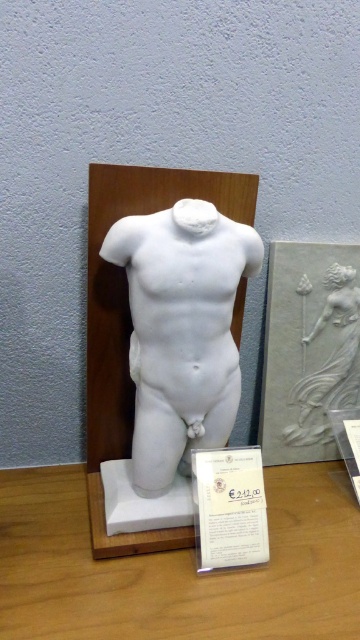
Question: Estimate the real-world distances between objects in this image. Which object is closer to the white marble torso at center?

Choices:
 (A) white marble relief at center
 (B) white paper at center
 (C) wooden table at center

Answer: (B)

Question: Estimate the real-world distances between objects in this image. Which object is farther from the white marble relief at center?

Choices:
 (A) white marble torso at center
 (B) wooden table at center
 (C) white paper at center

Answer: (A)

Question: Does white paper at center have a smaller size compared to white marble relief at center?

Choices:
 (A) no
 (B) yes

Answer: (B)

Question: Can you confirm if wooden table at center is smaller than white marble torso at center?

Choices:
 (A) yes
 (B) no

Answer: (B)

Question: Estimate the real-world distances between objects in this image. Which object is closer to the white marble relief at center?

Choices:
 (A) white paper at center
 (B) white marble torso at center
 (C) wooden table at center

Answer: (C)

Question: Is wooden table at center below white paper at center?

Choices:
 (A) no
 (B) yes

Answer: (B)